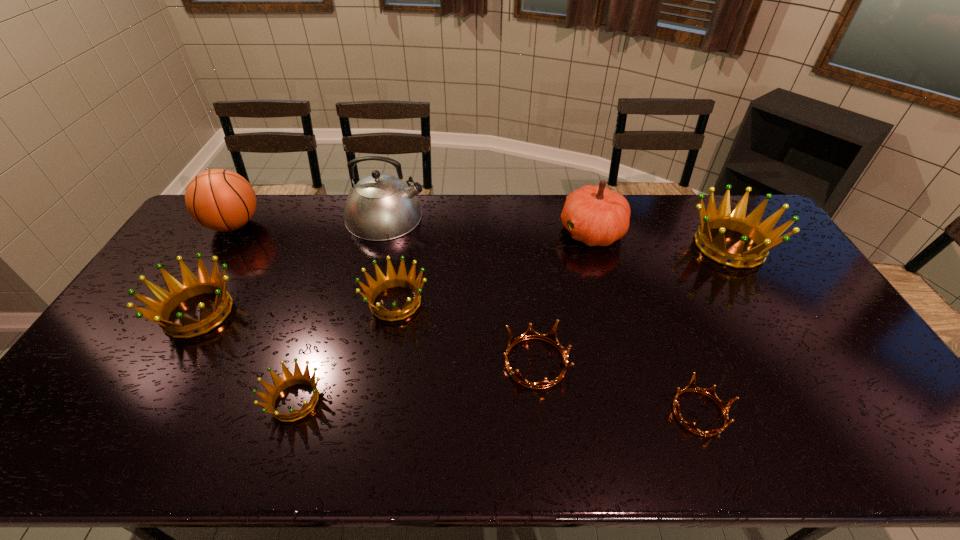
Where is `the sixth object from left to right`? the sixth object from left to right is located at coordinates (551, 337).

You are a GUI agent. You are given a task and a screenshot of the screen. Output one action in this format:
    pyautogui.click(x=<x>, y=<y>)
    Task: Click on the fifth crown from right to left
    The height and width of the screenshot is (540, 960).
    Given the screenshot: What is the action you would take?
    (x=289, y=379)

Image resolution: width=960 pixels, height=540 pixels. In order to click on the nearest golden crown in this screenshot , I will do `click(289, 379)`.

Find the location of a particular element. the shortest crown is located at coordinates (710, 392).

Identify the location of the smaller gold crown. This screenshot has height=540, width=960. (710, 392).

The height and width of the screenshot is (540, 960). I want to click on free space located from the spout of the kettle, so click(531, 217).

Where is `vacant space located on the right of the basketball`? vacant space located on the right of the basketball is located at coordinates (330, 225).

Find the location of a particular element. The height and width of the screenshot is (540, 960). vacant space located on the front-facing side of the pumpkin is located at coordinates (539, 232).

Where is `vacant space located 0.400m on the front-facing side of the pumpkin`? This screenshot has width=960, height=540. vacant space located 0.400m on the front-facing side of the pumpkin is located at coordinates (445, 232).

The width and height of the screenshot is (960, 540). I want to click on free space located 0.330m on the front-facing side of the pumpkin, so click(x=466, y=232).